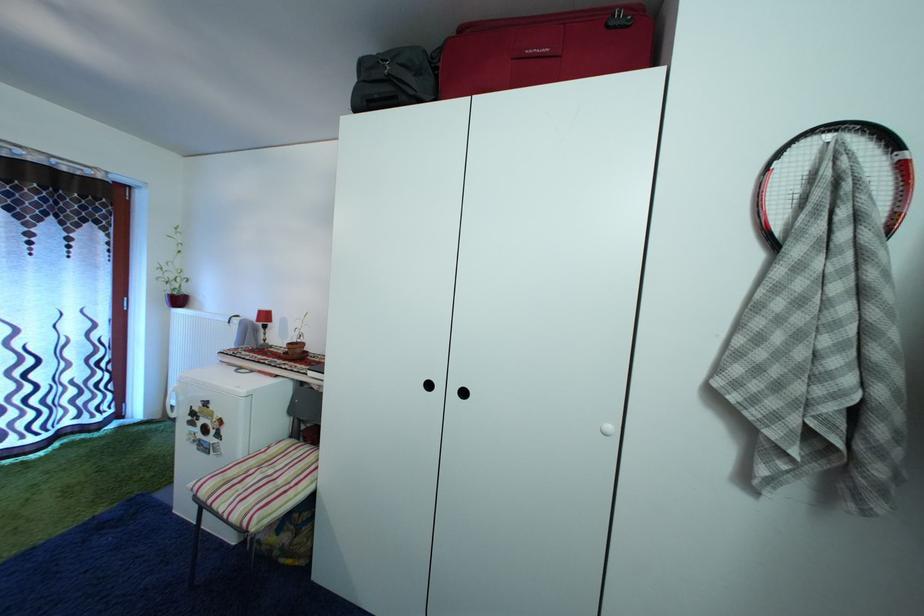
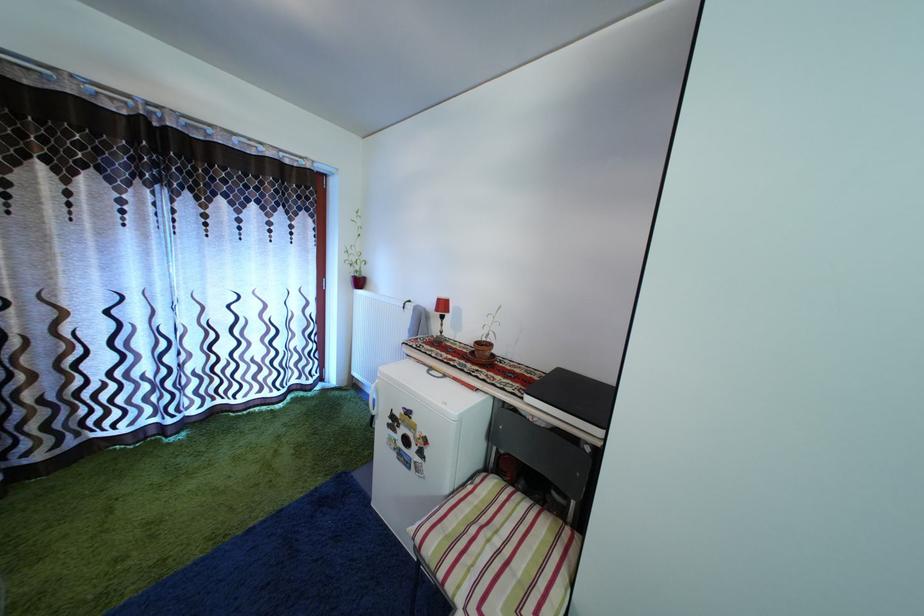
The images are taken continuously from a first-person perspective. In which direction are you moving?

The cameraman walked toward left, forward.